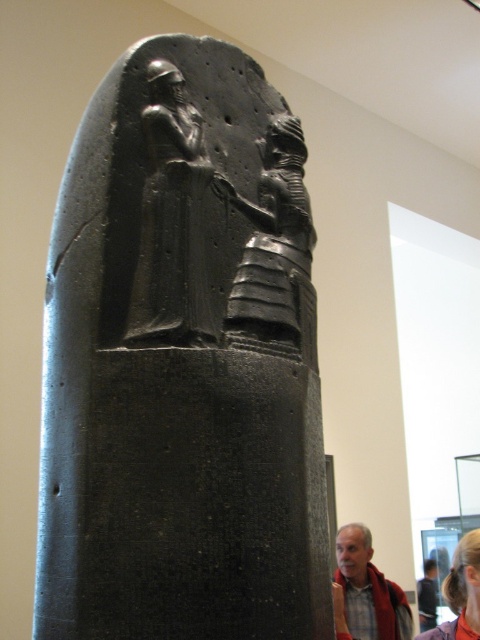
You are standing in a museum and see the gray fabric jacket at lower right and the blonde hair at lower right. Which object is located more to the left side?

The gray fabric jacket at lower right is positioned on the left side of blonde hair at lower right, so the gray fabric jacket at lower right is more to the left.

You are an art conservator examining the stele. You notice two features at the lower right corner of the stele. Which one is located below the other between the gray fabric jacket at lower right and the blonde hair at lower right?

The gray fabric jacket at lower right is positioned under the blonde hair at lower right, meaning the jacket is below the hair in the image.